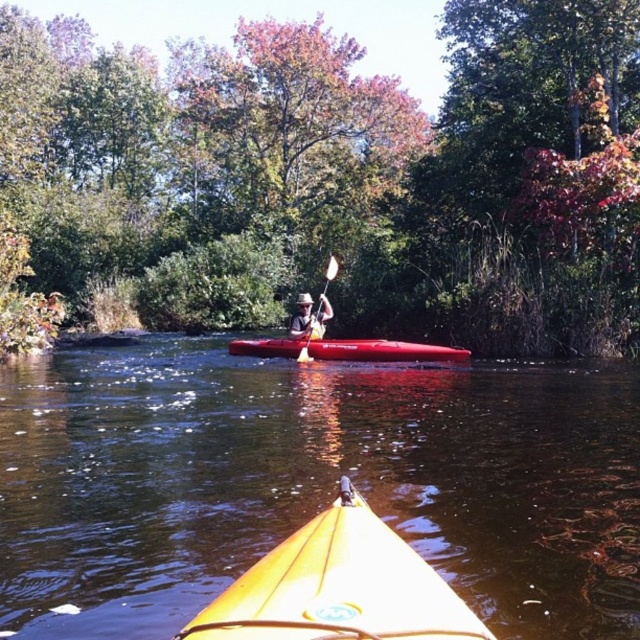
You are planning to rent a kayak for a family trip. You see two kayaks in the image, the yellow plastic kayak at center and the matte brown kayak at center. Which one is larger in size?

The yellow plastic kayak at center is bigger than the matte brown kayak at center, so the yellow plastic kayak at center is larger in size.

You are in a kayak on a calm river surrounded by greenery. You see a shiny red canoe at center and a white wood paddle at center. If you want to reach the paddle, which object should you move towards?

You should move towards the white wood paddle at center because it is closer to you than the shiny red canoe at center. The distance between them is 2.44 meters.